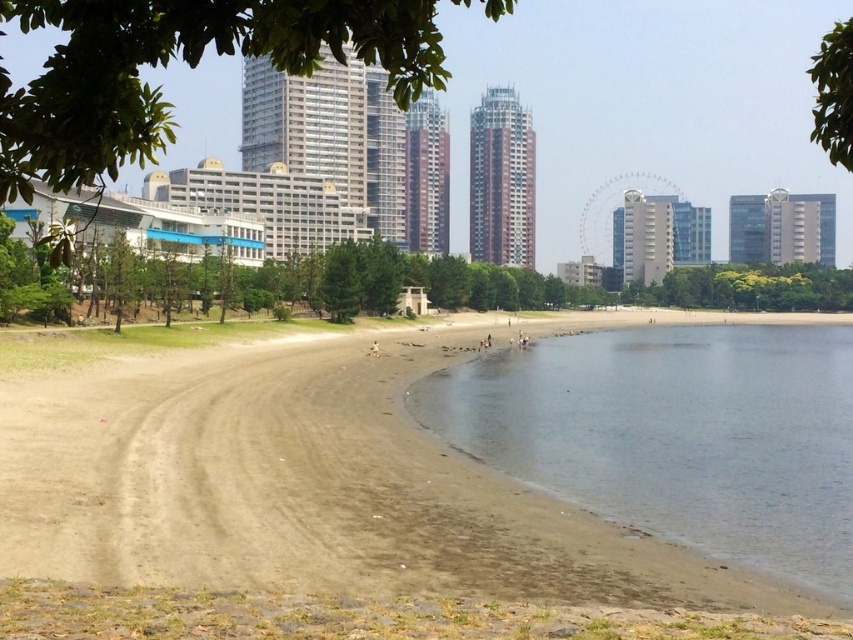
Between point (792, 308) and point (814, 104), which one is positioned in front?

Positioned in front is point (792, 308).

This screenshot has height=640, width=853. Describe the element at coordinates (747, 288) in the screenshot. I see `green leafy tree at center` at that location.

What do you see at coordinates (747, 288) in the screenshot? I see `green leafy tree at center` at bounding box center [747, 288].

You are a GUI agent. You are given a task and a screenshot of the screen. Output one action in this format:
    pyautogui.click(x=<x>, y=<y>)
    Task: Click on the green leafy tree at center
    The image size is (853, 640).
    Given the screenshot: What is the action you would take?
    747,288

Does clear water at lower right have a lesser width compared to green leafy tree at upper left?

Yes, clear water at lower right is thinner than green leafy tree at upper left.

Is clear water at lower right further to the viewer compared to green leafy tree at upper left?

Yes.

You are a GUI agent. You are given a task and a screenshot of the screen. Output one action in this format:
    pyautogui.click(x=<x>, y=<y>)
    Task: Click on the clear water at lower right
    The image size is (853, 640).
    Given the screenshot: What is the action you would take?
    pyautogui.click(x=675, y=435)

The height and width of the screenshot is (640, 853). I want to click on clear water at lower right, so click(675, 435).

From the picture: Does brown sand at lower left appear under green leafy tree at upper center?

Yes.

Describe the element at coordinates (317, 488) in the screenshot. I see `brown sand at lower left` at that location.

Which is in front, point (456, 634) or point (416, 42)?

Point (416, 42) is more forward.

At what (x,y) coordinates should I click in order to perform the action: click on brown sand at lower left. Please return your answer as a coordinate pair (x, y). Looking at the image, I should click on (317, 488).